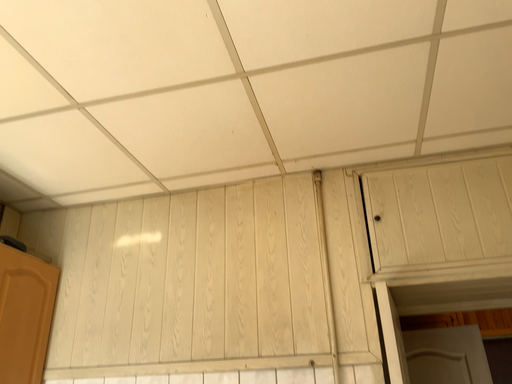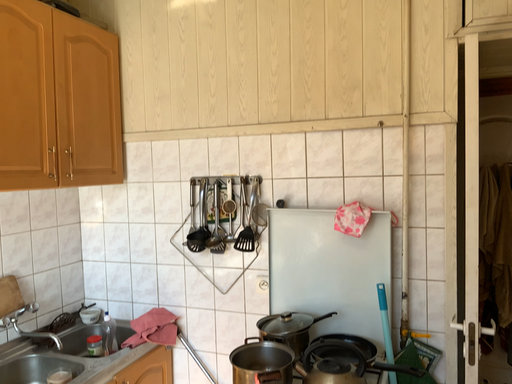
Question: Which way did the camera rotate in the video?

Choices:
 (A) rotated upward
 (B) rotated downward

Answer: (B)